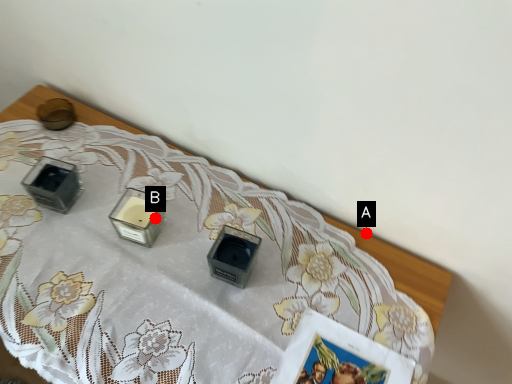
Question: Two points are circled on the image, labeled by A and B beside each circle. Which point is farther from the camera taking this photo?

Choices:
 (A) A is further
 (B) B is further

Answer: (A)